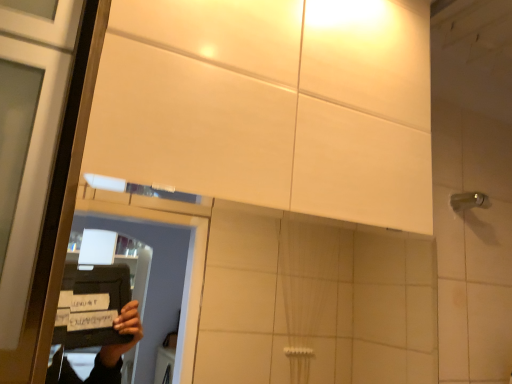
The height and width of the screenshot is (384, 512). What do you see at coordinates (469, 201) in the screenshot?
I see `metallic silver shower at right` at bounding box center [469, 201].

Identify the location of metallic silver shower at right. This screenshot has width=512, height=384. (469, 201).

You are a GUI agent. You are given a task and a screenshot of the screen. Output one action in this format:
    pyautogui.click(x=<x>, y=<y>)
    Task: Click on the metallic silver shower at right
    
    Given the screenshot: What is the action you would take?
    pyautogui.click(x=469, y=201)